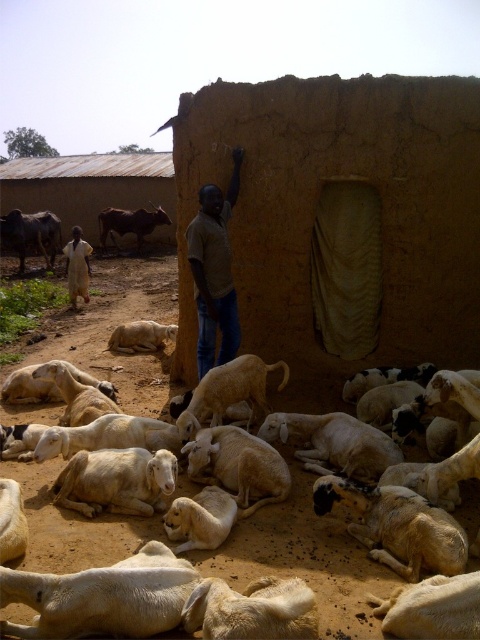
Question: Is white woolen goat at center below light brown fabric dress at lower left?

Choices:
 (A) no
 (B) yes

Answer: (B)

Question: Which object is farther from the camera taking this photo?

Choices:
 (A) matte brown shirt at center
 (B) white woolen goat at center
 (C) white woolen sheep at center
 (D) white woolen goat at lower left

Answer: (B)

Question: Does white woolen goat at center lie behind light brown fabric dress at lower left?

Choices:
 (A) yes
 (B) no

Answer: (B)

Question: Among these points, which one is farthest from the camera?

Choices:
 (A) (126, 324)
 (B) (108, 477)

Answer: (A)

Question: Can you confirm if white woolen sheep at center is positioned above matte brown shirt at center?

Choices:
 (A) yes
 (B) no

Answer: (B)

Question: Which point appears farthest from the camera in this image?

Choices:
 (A) (146, 328)
 (B) (74, 264)
 (C) (230, 364)
 (D) (264, 557)

Answer: (B)